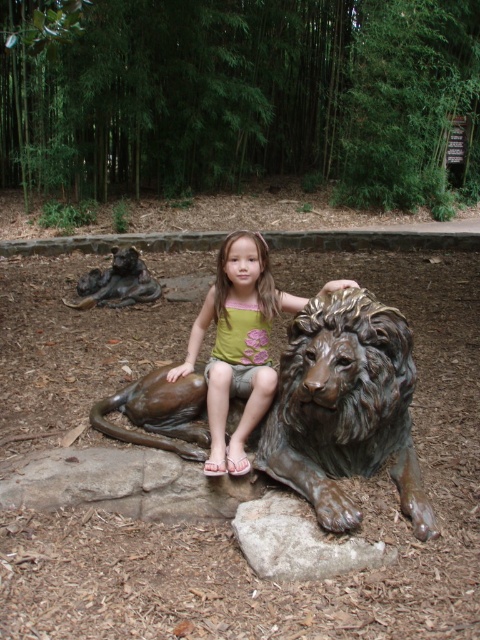
You are a sculptor who wants to create a miniature version of the scene. You need to know the size relationship between the matte bronze lion at center and the gray stone at lower center to scale them correctly. Which object is bigger?

The matte bronze lion at center has a larger size compared to the gray stone at lower center, so the lion should be scaled larger than the stone.

Based on the photo, you are standing at the point labeled as point [156,282] and want to walk to the point labeled as point [385,316]. Which direction should you face to walk towards your destination?

You should face towards the front direction because point [385,316] is in front of point [156,282].